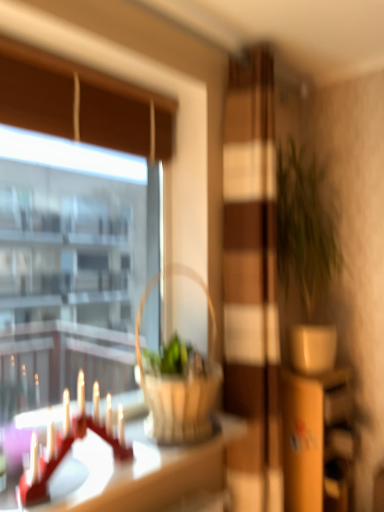
Question: From a real-world perspective, is green matte plant at right over white glossy table at lower left?

Choices:
 (A) no
 (B) yes

Answer: (B)

Question: Can you confirm if green matte plant at right is taller than white glossy table at lower left?

Choices:
 (A) no
 (B) yes

Answer: (B)

Question: Is green matte plant at right to the right of white glossy table at lower left from the viewer's perspective?

Choices:
 (A) no
 (B) yes

Answer: (B)

Question: Is green matte plant at right next to white glossy table at lower left and touching it?

Choices:
 (A) yes
 (B) no

Answer: (B)

Question: Can you confirm if green matte plant at right is shorter than white glossy table at lower left?

Choices:
 (A) yes
 (B) no

Answer: (B)

Question: Is green matte plant at right thinner than white glossy table at lower left?

Choices:
 (A) no
 (B) yes

Answer: (B)

Question: Would you say wooden screen door at center is a long distance from green matte plant at right?

Choices:
 (A) yes
 (B) no

Answer: (B)

Question: Could green matte plant at right be considered to be inside wooden screen door at center?

Choices:
 (A) no
 (B) yes

Answer: (A)

Question: From a real-world perspective, is wooden screen door at center over green matte plant at right?

Choices:
 (A) no
 (B) yes

Answer: (A)

Question: Is the depth of wooden screen door at center greater than that of green matte plant at right?

Choices:
 (A) yes
 (B) no

Answer: (B)

Question: Can you confirm if wooden screen door at center is bigger than green matte plant at right?

Choices:
 (A) no
 (B) yes

Answer: (B)

Question: Are wooden screen door at center and green matte plant at right making contact?

Choices:
 (A) no
 (B) yes

Answer: (A)

Question: Is transparent glass window at upper left completely or partially outside of woven wood picnic basket at center?

Choices:
 (A) no
 (B) yes

Answer: (B)